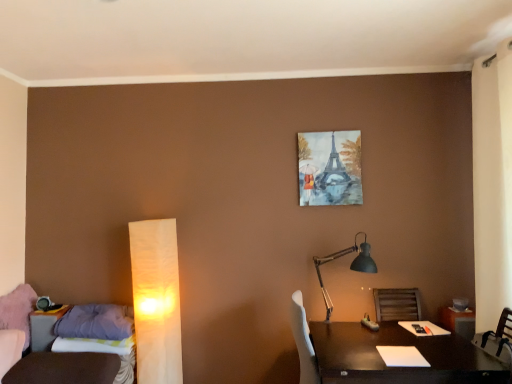
Question: Is purple fabric pillow at lower left positioned in front of dark wood table at lower right?

Choices:
 (A) yes
 (B) no

Answer: (B)

Question: Is purple fabric pillow at lower left turned away from dark wood table at lower right?

Choices:
 (A) yes
 (B) no

Answer: (B)

Question: From a real-world perspective, does purple fabric pillow at lower left stand above dark wood table at lower right?

Choices:
 (A) yes
 (B) no

Answer: (A)

Question: Considering the relative sizes of purple fabric pillow at lower left and dark wood table at lower right in the image provided, is purple fabric pillow at lower left thinner than dark wood table at lower right?

Choices:
 (A) yes
 (B) no

Answer: (A)

Question: Can you confirm if purple fabric pillow at lower left is taller than dark wood table at lower right?

Choices:
 (A) yes
 (B) no

Answer: (B)

Question: From a real-world perspective, is dark wood table at lower right above or below white paper lamp at left, arranged as the first lamp when viewed from the left?

Choices:
 (A) below
 (B) above

Answer: (A)

Question: Is dark wood table at lower right inside or outside of white paper lamp at left, positioned as the 2th lamp in right-to-left order?

Choices:
 (A) outside
 (B) inside

Answer: (A)

Question: In terms of height, does dark wood table at lower right look taller or shorter compared to white paper lamp at left, positioned as the 2th lamp in right-to-left order?

Choices:
 (A) short
 (B) tall

Answer: (A)

Question: Is dark wood table at lower right bigger or smaller than white paper lamp at left, positioned as the 2th lamp in right-to-left order?

Choices:
 (A) small
 (B) big

Answer: (B)

Question: Does point (56, 324) appear closer or farther from the camera than point (177, 261)?

Choices:
 (A) closer
 (B) farther

Answer: (A)

Question: From a real-world perspective, relative to white paper lamp at left, arranged as the first lamp when viewed from the left, is purple fabric pillow at lower left vertically above or below?

Choices:
 (A) above
 (B) below

Answer: (B)

Question: Is purple fabric pillow at lower left inside the boundaries of white paper lamp at left, arranged as the first lamp when viewed from the left, or outside?

Choices:
 (A) outside
 (B) inside

Answer: (A)

Question: Considering the positions of purple fabric pillow at lower left and white paper lamp at left, arranged as the first lamp when viewed from the left, in the image, is purple fabric pillow at lower left bigger or smaller than white paper lamp at left, arranged as the first lamp when viewed from the left,?

Choices:
 (A) small
 (B) big

Answer: (A)

Question: Does point (355, 134) appear closer or farther from the camera than point (83, 329)?

Choices:
 (A) farther
 (B) closer

Answer: (A)

Question: From the image's perspective, is watercolor painting of eiffel tower at upper center located above or below purple fabric pillow at lower left?

Choices:
 (A) below
 (B) above

Answer: (B)